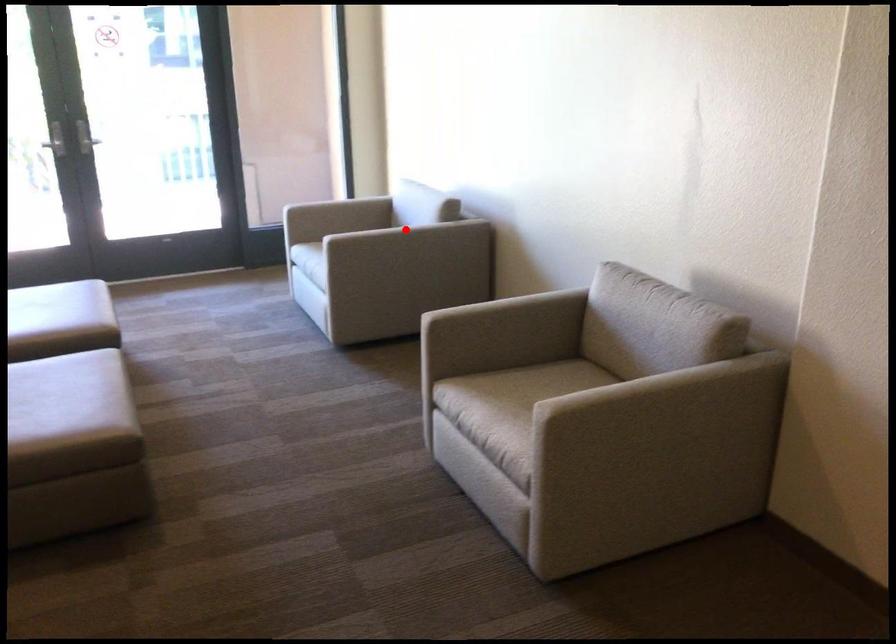
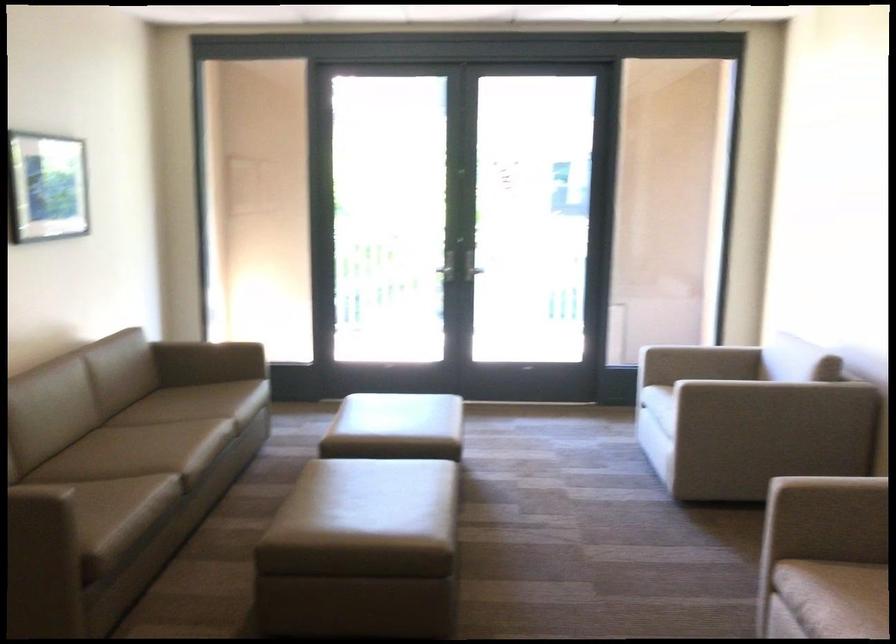
Find the pixel in the second image that matches the highlighted location in the first image.

(774, 392)